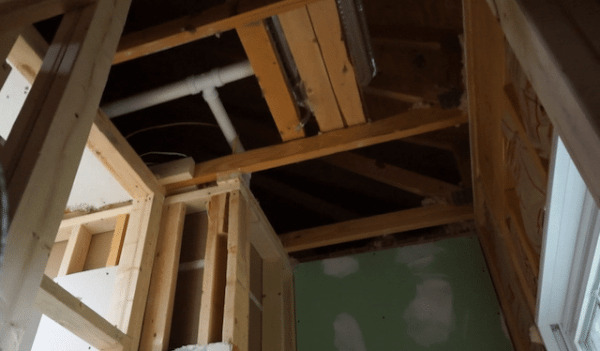
Find the location of a particular element. The height and width of the screenshot is (351, 600). spackle is located at coordinates (430, 311), (348, 331), (337, 268), (419, 251).